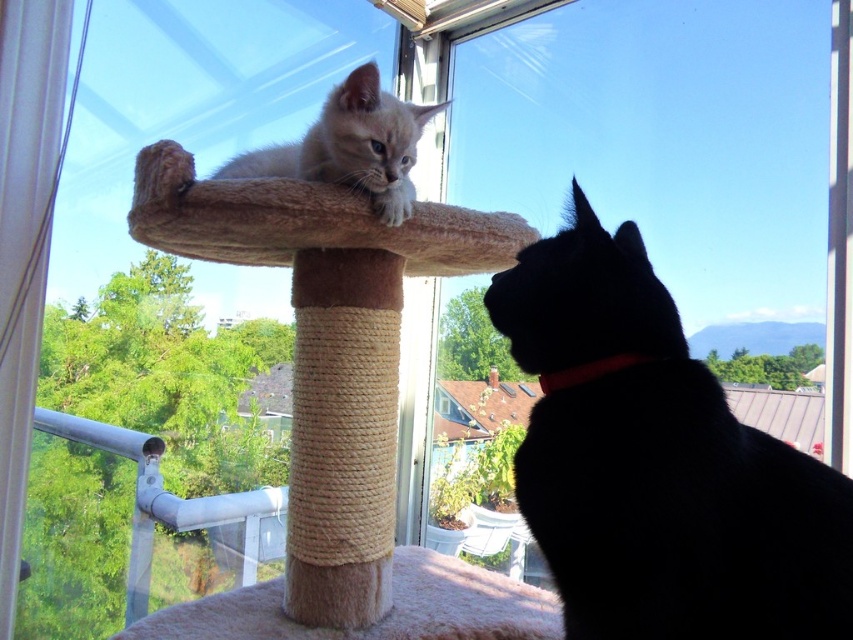
Which is in front, point (630, 595) or point (589, 368)?

Point (630, 595) is in front.

In order to click on black fur cat at upper right in this screenshot , I will do `click(659, 465)`.

Is light brown fur at upper center positioned before red fabric neckband at lower right?

That is False.

At what (x,y) coordinates should I click in order to perform the action: click on light brown fur at upper center. Please return your answer as a coordinate pair (x, y). This screenshot has height=640, width=853. Looking at the image, I should click on (351, 145).

Does beige plush cat bed at center have a lesser height compared to red fabric neckband at lower right?

In fact, beige plush cat bed at center may be taller than red fabric neckband at lower right.

Between beige plush cat bed at center and red fabric neckband at lower right, which one appears on the right side from the viewer's perspective?

red fabric neckband at lower right is more to the right.

What do you see at coordinates (381, 618) in the screenshot?
I see `beige plush cat bed at center` at bounding box center [381, 618].

Find the location of `beige plush cat bed at center`. beige plush cat bed at center is located at coordinates (381, 618).